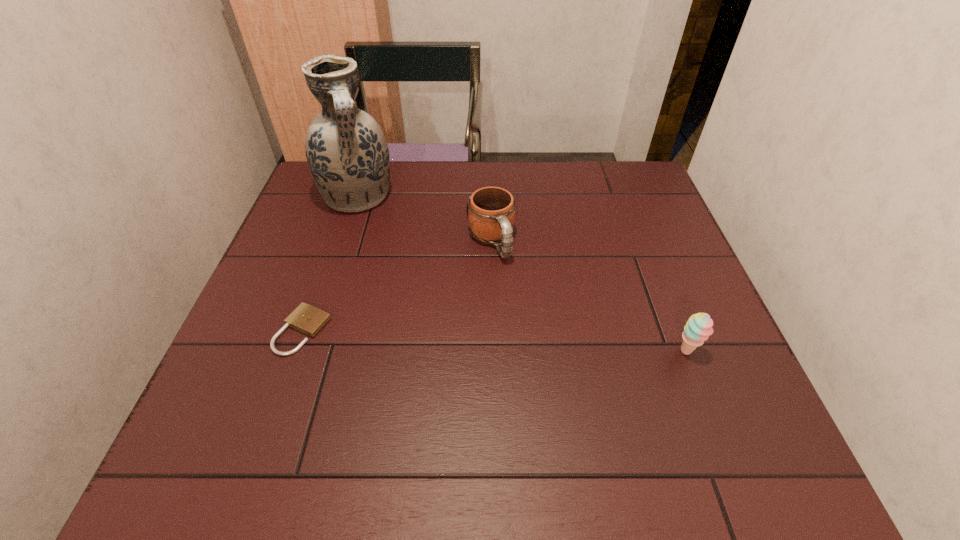
Find the location of a particular element. Image resolution: width=960 pixels, height=540 pixels. vacant point at the far right corner is located at coordinates (645, 190).

Find the location of a particular element. The width and height of the screenshot is (960, 540). free space that is in between the second object from right to left and the padlock is located at coordinates (396, 286).

This screenshot has width=960, height=540. In order to click on free point between the tallest object and the third object from left to right in this screenshot , I will do `click(424, 219)`.

Where is `free spot between the shortest object and the mug`? This screenshot has width=960, height=540. free spot between the shortest object and the mug is located at coordinates (396, 286).

What are the coordinates of `free space between the rightmost object and the second object from right to left` in the screenshot? It's located at point(588,296).

Locate an element on the screen. Image resolution: width=960 pixels, height=540 pixels. empty space that is in between the sherbert and the mug is located at coordinates (588, 296).

At what (x,y) coordinates should I click in order to perform the action: click on free space between the padlock and the second object from right to left. Please return your answer as a coordinate pair (x, y). The width and height of the screenshot is (960, 540). Looking at the image, I should click on (396, 286).

Where is `vacant space that is in between the third object from left to right and the sherbert`? vacant space that is in between the third object from left to right and the sherbert is located at coordinates (588, 296).

You are a GUI agent. You are given a task and a screenshot of the screen. Output one action in this format:
    pyautogui.click(x=<x>, y=<y>)
    Task: Click on the unoccupied area between the rightmost object and the tallest object
    This screenshot has width=960, height=540.
    Given the screenshot: What is the action you would take?
    pyautogui.click(x=522, y=274)

I want to click on blank region between the vase and the sherbert, so click(x=522, y=274).